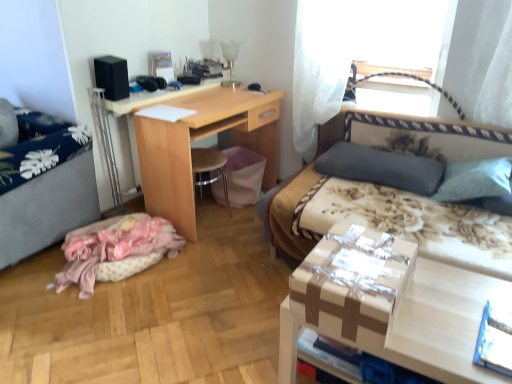
Question: Is black matte speaker at upper left located within floral fabric bed at right?

Choices:
 (A) no
 (B) yes

Answer: (A)

Question: Is floral fabric bed at right shorter than black matte speaker at upper left?

Choices:
 (A) no
 (B) yes

Answer: (A)

Question: Is floral fabric bed at right looking in the opposite direction of black matte speaker at upper left?

Choices:
 (A) yes
 (B) no

Answer: (B)

Question: Is floral fabric bed at right touching black matte speaker at upper left?

Choices:
 (A) yes
 (B) no

Answer: (B)

Question: Does floral fabric bed at right have a lesser width compared to black matte speaker at upper left?

Choices:
 (A) no
 (B) yes

Answer: (A)

Question: From the image's perspective, is gray fabric hospital bed at left located above or below matte cardboard box at lower right?

Choices:
 (A) above
 (B) below

Answer: (A)

Question: Would you say gray fabric hospital bed at left is inside or outside matte cardboard box at lower right?

Choices:
 (A) inside
 (B) outside

Answer: (B)

Question: Visually, is gray fabric hospital bed at left positioned to the left or to the right of matte cardboard box at lower right?

Choices:
 (A) left
 (B) right

Answer: (A)

Question: Is gray fabric hospital bed at left in front of or behind matte cardboard box at lower right in the image?

Choices:
 (A) behind
 (B) front

Answer: (A)

Question: Based on their positions, is wooden desk at center located to the left or right of pink fabric at lower left?

Choices:
 (A) right
 (B) left

Answer: (A)

Question: Looking at the image, does wooden desk at center seem bigger or smaller compared to pink fabric at lower left?

Choices:
 (A) small
 (B) big

Answer: (B)

Question: In the image, is wooden desk at center positioned in front of or behind pink fabric at lower left?

Choices:
 (A) front
 (B) behind

Answer: (B)

Question: In terms of width, does wooden desk at center look wider or thinner when compared to pink fabric at lower left?

Choices:
 (A) wide
 (B) thin

Answer: (B)

Question: Which is correct: dark gray fabric pillow at upper right is inside pink fabric at lower left, or outside of it?

Choices:
 (A) outside
 (B) inside

Answer: (A)

Question: Does point pyautogui.click(x=437, y=185) appear closer or farther from the camera than point pyautogui.click(x=109, y=223)?

Choices:
 (A) farther
 (B) closer

Answer: (B)